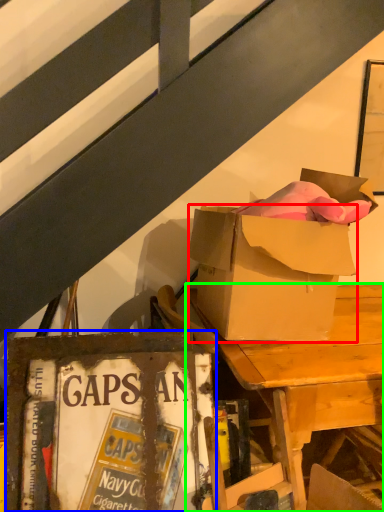
Question: Based on their relative distances, which object is nearer to box (highlighted by a red box)? Choose from paperback book (highlighted by a blue box) and desk (highlighted by a green box).

Choices:
 (A) paperback book
 (B) desk

Answer: (B)